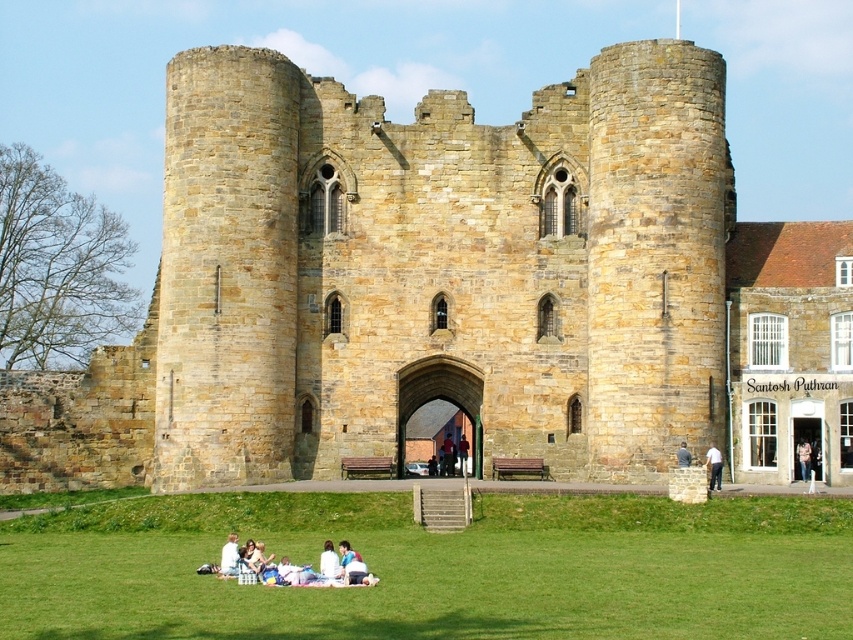
Does dark gray stone person at center have a lesser width compared to dark blue jeans at center?

Correct, dark gray stone person at center's width is less than dark blue jeans at center's.

Find the location of a particular element. dark gray stone person at center is located at coordinates point(712,467).

Is green grass at lower center below dark gray stone person at center?

→ Yes, green grass at lower center is below dark gray stone person at center.

Who is more forward, [695,570] or [717,468]?

Positioned in front is point [695,570].

Does point (537, 570) come in front of point (718, 472)?

Yes, point (537, 570) is closer to viewer.

Where is `green grass at lower center`? The height and width of the screenshot is (640, 853). green grass at lower center is located at coordinates (438, 568).

Is point (718, 461) positioned before point (689, 461)?

Yes, point (718, 461) is closer to viewer.

Looking at this image, is dark gray stone person at center thinner than light brown stone wall at center?

Yes.

Describe the element at coordinates (712, 467) in the screenshot. This screenshot has height=640, width=853. I see `dark gray stone person at center` at that location.

Locate an element on the screen. The height and width of the screenshot is (640, 853). dark gray stone person at center is located at coordinates (712, 467).